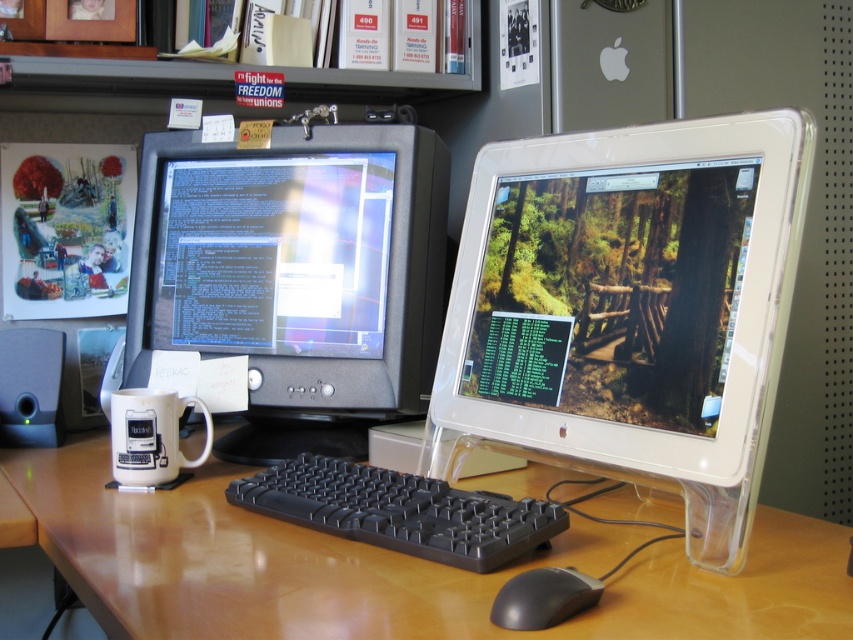
Is brown wood computer desk at center taller than white ceramic mug at lower left?

No, brown wood computer desk at center is not taller than white ceramic mug at lower left.

Is point (236, 470) closer to camera compared to point (163, 396)?

No, it is not.

Locate an element on the screen. The height and width of the screenshot is (640, 853). brown wood computer desk at center is located at coordinates (389, 568).

Is point (679, 349) farther from camera compared to point (508, 627)?

Yes.

Consider the image. Does white plastic monitor at center appear over black plastic mouse at lower center?

Correct, white plastic monitor at center is located above black plastic mouse at lower center.

At what (x,y) coordinates should I click in order to perform the action: click on white plastic monitor at center. Please return your answer as a coordinate pair (x, y). Looking at the image, I should click on (631, 307).

Does point (165, 472) come farther from viewer compared to point (564, 604)?

Yes, point (165, 472) is farther from viewer.

Can you confirm if white ceramic mug at lower left is positioned to the left of black plastic mouse at lower center?

Indeed, white ceramic mug at lower left is positioned on the left side of black plastic mouse at lower center.

Find the location of `white ceramic mug at lower left`. white ceramic mug at lower left is located at coordinates (149, 435).